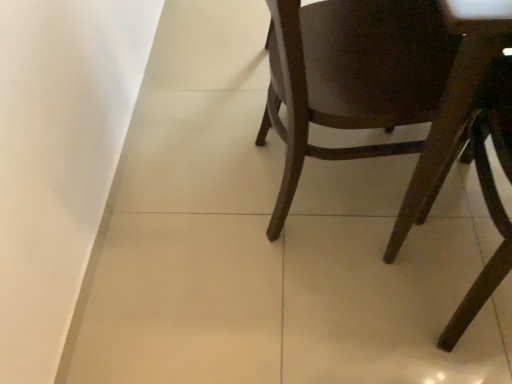
Measure the distance between dark wood chair at right, acting as the second chair starting from the right, and camera.

A distance of 19.72 inches exists between dark wood chair at right, acting as the second chair starting from the right, and camera.

At what (x,y) coordinates should I click in order to perform the action: click on dark wood chair at right, which is the first chair in left-to-right order. Please return your answer as a coordinate pair (x, y). The width and height of the screenshot is (512, 384). Looking at the image, I should click on (378, 82).

Image resolution: width=512 pixels, height=384 pixels. What do you see at coordinates (378, 82) in the screenshot?
I see `dark wood chair at right, which is the first chair in left-to-right order` at bounding box center [378, 82].

The height and width of the screenshot is (384, 512). Describe the element at coordinates (483, 189) in the screenshot. I see `dark wood chair at lower right, the 2th chair in the left-to-right sequence` at that location.

Locate an element on the screen. The image size is (512, 384). dark wood chair at lower right, the 2th chair in the left-to-right sequence is located at coordinates (483, 189).

I want to click on dark wood chair at right, acting as the second chair starting from the right, so click(378, 82).

Which object is positioned more to the left, dark wood chair at right, acting as the second chair starting from the right, or dark wood chair at lower right, the 1th chair viewed from the right?

dark wood chair at right, acting as the second chair starting from the right, is more to the left.

Is the depth of dark wood chair at right, which is the first chair in left-to-right order, greater than that of dark wood chair at lower right, the 1th chair viewed from the right?

Yes, dark wood chair at right, which is the first chair in left-to-right order, is further from the viewer.

Is point (284, 184) closer or farther from the camera than point (483, 299)?

Point (284, 184).

From the image's perspective, would you say dark wood chair at right, acting as the second chair starting from the right, is positioned over dark wood chair at lower right, the 1th chair viewed from the right?

Yes, from the image's perspective, dark wood chair at right, acting as the second chair starting from the right, is on top of dark wood chair at lower right, the 1th chair viewed from the right.

From a real-world perspective, is dark wood chair at right, which is the first chair in left-to-right order, positioned under dark wood chair at lower right, the 2th chair in the left-to-right sequence, based on gravity?

Incorrect, from a real-world perspective, dark wood chair at right, which is the first chair in left-to-right order, is higher than dark wood chair at lower right, the 2th chair in the left-to-right sequence.

In the scene shown: Considering the sizes of objects dark wood chair at right, which is the first chair in left-to-right order, and dark wood chair at lower right, the 2th chair in the left-to-right sequence, in the image provided, who is wider, dark wood chair at right, which is the first chair in left-to-right order, or dark wood chair at lower right, the 2th chair in the left-to-right sequence,?

Wider between the two is dark wood chair at right, which is the first chair in left-to-right order.

Considering the sizes of objects dark wood chair at right, which is the first chair in left-to-right order, and dark wood chair at lower right, the 2th chair in the left-to-right sequence, in the image provided, who is shorter, dark wood chair at right, which is the first chair in left-to-right order, or dark wood chair at lower right, the 2th chair in the left-to-right sequence,?

With less height is dark wood chair at lower right, the 2th chair in the left-to-right sequence.

Based on their sizes in the image, would you say dark wood chair at right, acting as the second chair starting from the right, is bigger or smaller than dark wood chair at lower right, the 2th chair in the left-to-right sequence?

dark wood chair at right, acting as the second chair starting from the right, is bigger than dark wood chair at lower right, the 2th chair in the left-to-right sequence.

Choose the correct answer: Is dark wood chair at right, acting as the second chair starting from the right, inside dark wood chair at lower right, the 1th chair viewed from the right, or outside it?

dark wood chair at right, acting as the second chair starting from the right, exists outside the volume of dark wood chair at lower right, the 1th chair viewed from the right.

Is dark wood chair at right, acting as the second chair starting from the right, far away from dark wood chair at lower right, the 1th chair viewed from the right?

No, there isn't a large distance between dark wood chair at right, acting as the second chair starting from the right, and dark wood chair at lower right, the 1th chair viewed from the right.

Could you tell me if dark wood chair at right, acting as the second chair starting from the right, is turned towards dark wood chair at lower right, the 2th chair in the left-to-right sequence?

No.

How much distance is there between dark wood chair at right, acting as the second chair starting from the right, and dark wood chair at lower right, the 2th chair in the left-to-right sequence?

The distance of dark wood chair at right, acting as the second chair starting from the right, from dark wood chair at lower right, the 2th chair in the left-to-right sequence, is 8.57 inches.

Identify the location of chair behind the dark wood chair at lower right, the 1th chair viewed from the right. The height and width of the screenshot is (384, 512). (378, 82).

Based on the photo, does dark wood chair at lower right, the 1th chair viewed from the right, appear on the right side of dark wood chair at right, which is the first chair in left-to-right order?

Yes.

Does dark wood chair at lower right, the 1th chair viewed from the right, lie behind dark wood chair at right, acting as the second chair starting from the right?

No, the depth of dark wood chair at lower right, the 1th chair viewed from the right, is less than that of dark wood chair at right, acting as the second chair starting from the right.

Which is closer, (477, 159) or (332, 51)?

Point (332, 51)

From the image's perspective, is dark wood chair at lower right, the 2th chair in the left-to-right sequence, located above or below dark wood chair at right, acting as the second chair starting from the right?

From the image's perspective, dark wood chair at lower right, the 2th chair in the left-to-right sequence, appears below dark wood chair at right, acting as the second chair starting from the right.

From a real-world perspective, which object stands above the other?

dark wood chair at right, which is the first chair in left-to-right order, is physically above.

Between dark wood chair at lower right, the 1th chair viewed from the right, and dark wood chair at right, which is the first chair in left-to-right order, which one has smaller width?

dark wood chair at lower right, the 1th chair viewed from the right.

Between dark wood chair at lower right, the 1th chair viewed from the right, and dark wood chair at right, acting as the second chair starting from the right, which one has less height?

With less height is dark wood chair at lower right, the 1th chair viewed from the right.

Can you confirm if dark wood chair at lower right, the 2th chair in the left-to-right sequence, is smaller than dark wood chair at right, which is the first chair in left-to-right order?

Yes.

Do you think dark wood chair at lower right, the 2th chair in the left-to-right sequence, is within dark wood chair at right, which is the first chair in left-to-right order, or outside of it?

dark wood chair at lower right, the 2th chair in the left-to-right sequence, exists outside the volume of dark wood chair at right, which is the first chair in left-to-right order.

Is dark wood chair at lower right, the 1th chair viewed from the right, next to dark wood chair at right, which is the first chair in left-to-right order?

No.

Does dark wood chair at lower right, the 1th chair viewed from the right, turn towards dark wood chair at right, acting as the second chair starting from the right?

No, dark wood chair at lower right, the 1th chair viewed from the right, is not facing towards dark wood chair at right, acting as the second chair starting from the right.

How many degrees apart are the facing directions of dark wood chair at lower right, the 2th chair in the left-to-right sequence, and dark wood chair at right, which is the first chair in left-to-right order?

The angular difference between dark wood chair at lower right, the 2th chair in the left-to-right sequence, and dark wood chair at right, which is the first chair in left-to-right order, is 75.1 degrees.

Image resolution: width=512 pixels, height=384 pixels. I want to click on chair that is in front of the dark wood chair at right, acting as the second chair starting from the right, so click(483, 189).

Where is `chair that appears above the dark wood chair at lower right, the 2th chair in the left-to-right sequence (from a real-world perspective)`? chair that appears above the dark wood chair at lower right, the 2th chair in the left-to-right sequence (from a real-world perspective) is located at coordinates (378, 82).

Where is `chair located on the left of dark wood chair at lower right, the 2th chair in the left-to-right sequence`? The height and width of the screenshot is (384, 512). chair located on the left of dark wood chair at lower right, the 2th chair in the left-to-right sequence is located at coordinates (378, 82).